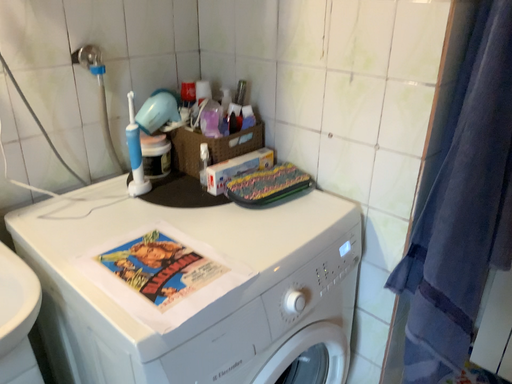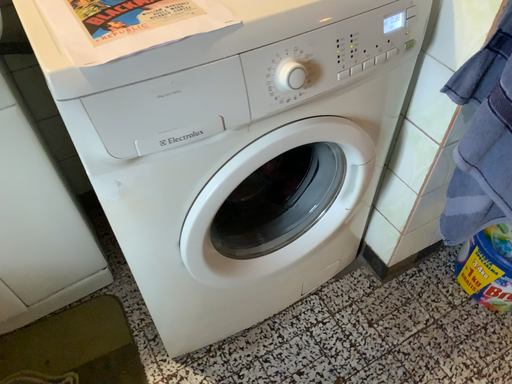
Question: Which way did the camera rotate in the video?

Choices:
 (A) rotated upward
 (B) rotated downward

Answer: (B)